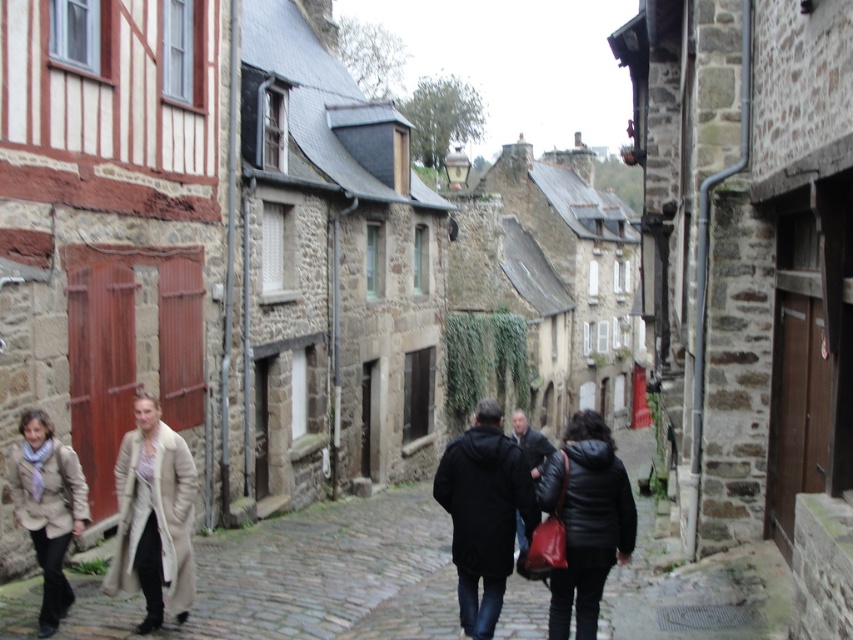
Who is more forward, (x=128, y=474) or (x=28, y=513)?

Point (x=28, y=513) is in front.

Is beige wool coat at center closer to camera compared to beige wool coat at lower left?

No, beige wool coat at center is further to the viewer.

Describe the element at coordinates (154, 516) in the screenshot. I see `beige wool coat at center` at that location.

Find the location of a particular element. Image resolution: width=853 pixels, height=640 pixels. beige wool coat at center is located at coordinates (154, 516).

Is black matte coat at center wider than beige wool coat at center?

Yes, black matte coat at center is wider than beige wool coat at center.

Consider the image. Can you confirm if black matte coat at center is positioned to the left of beige wool coat at center?

Incorrect, black matte coat at center is not on the left side of beige wool coat at center.

Is point (485, 509) closer to camera compared to point (137, 540)?

Yes, point (485, 509) is closer to viewer.

I want to click on black matte coat at center, so click(x=486, y=512).

Is black matte coat at center to the left of beige wool coat at lower left from the viewer's perspective?

In fact, black matte coat at center is to the right of beige wool coat at lower left.

Measure the distance between black matte coat at center and camera.

black matte coat at center and camera are 25.55 feet apart from each other.

Does point (457, 445) come behind point (61, 564)?

No.

The height and width of the screenshot is (640, 853). Identify the location of black matte coat at center. (486, 512).